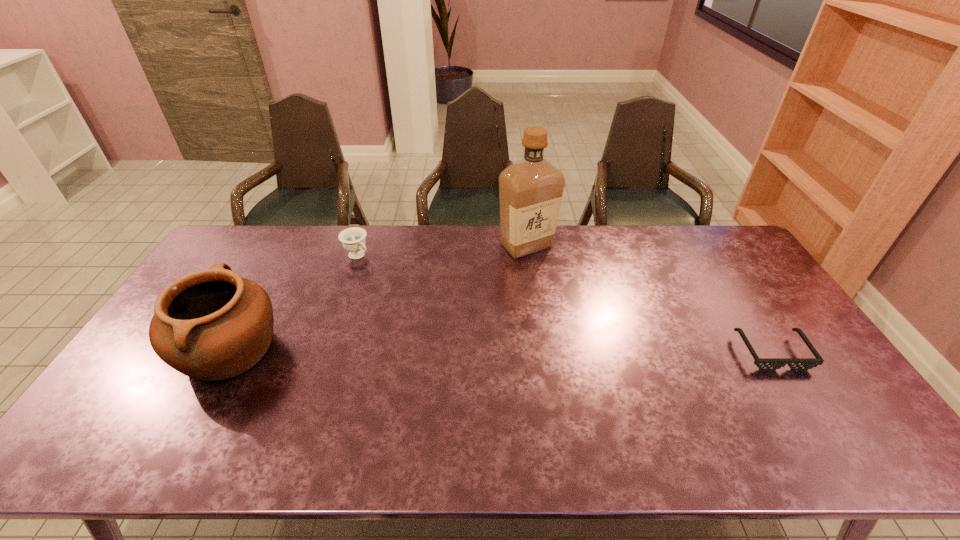
Identify the location of free spot that satisfies the following two spatial constraints: 1. on the back side of the teacup; 2. on the left side of the pottery. (282, 255).